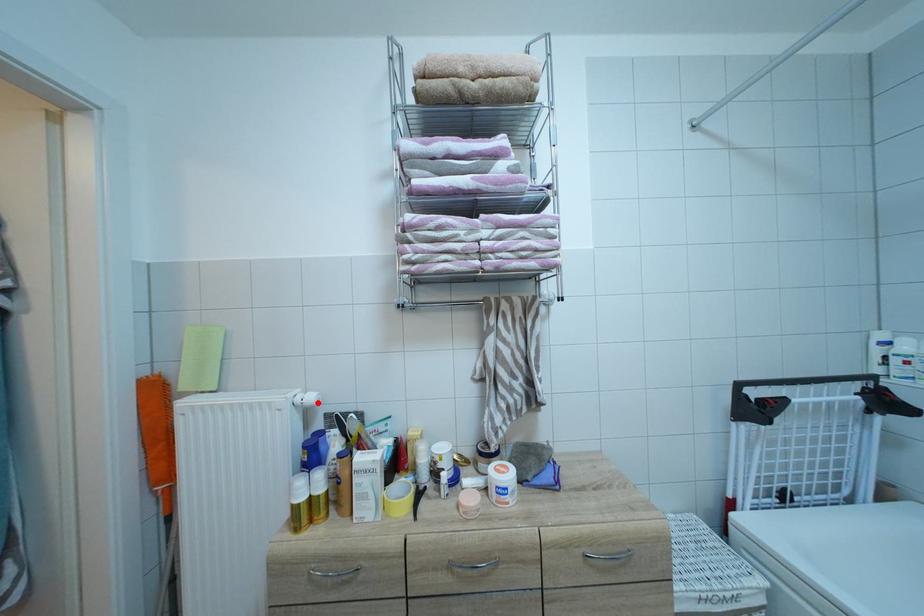
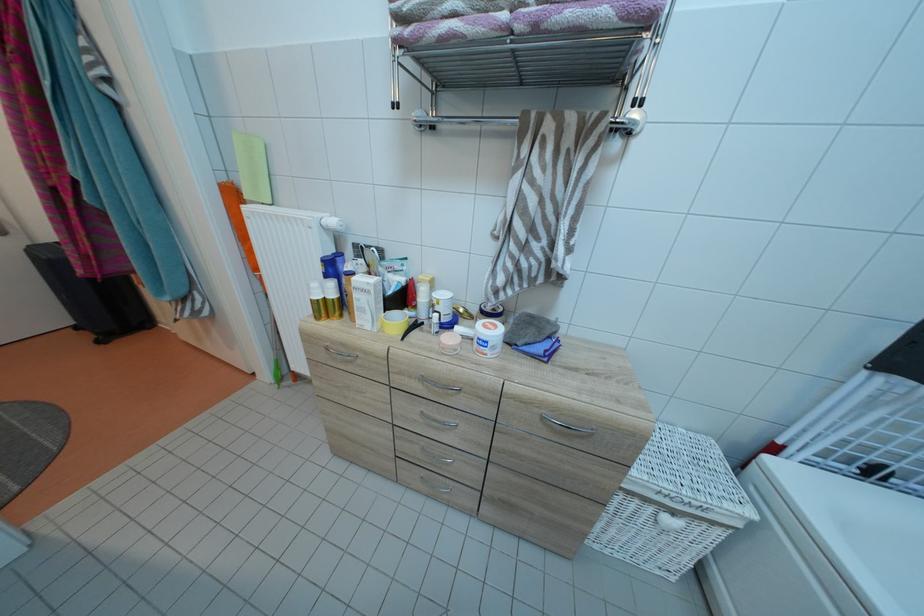
Where in the second image is the point corresponding to the highlighted location from the first image?

(341, 227)